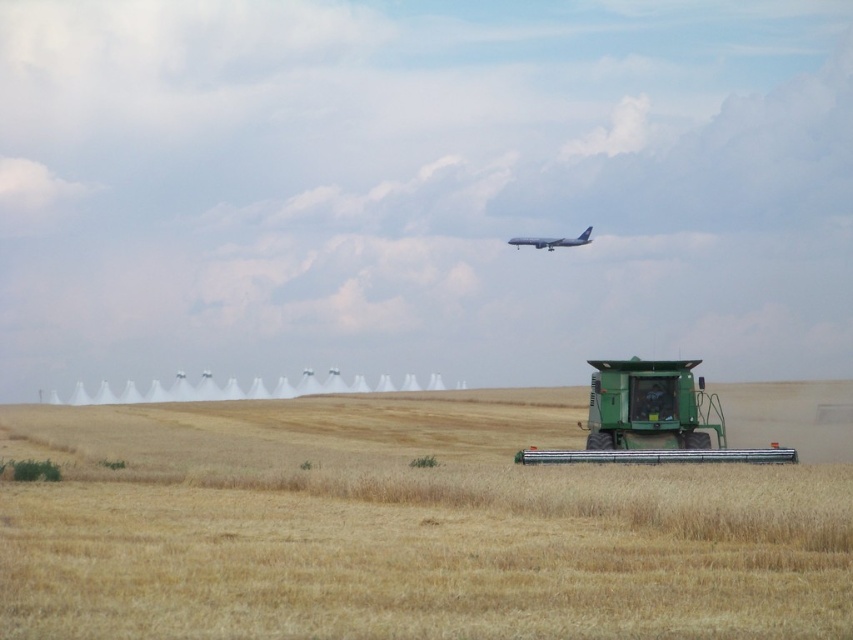
Question: Can you confirm if green matte combine at lower right is bigger than white matte airplane at upper center?

Choices:
 (A) yes
 (B) no

Answer: (B)

Question: Considering the real-world distances, which object is closest to the golden matte wheat field at center?

Choices:
 (A) white matte airplane at upper center
 (B) green matte combine at lower right

Answer: (B)

Question: Which of these objects is positioned farthest from the golden matte wheat field at center?

Choices:
 (A) white matte airplane at upper center
 (B) green matte combine at lower right

Answer: (A)

Question: Among these points, which one is nearest to the camera?

Choices:
 (A) (601, 422)
 (B) (456, 456)

Answer: (A)

Question: Is green matte combine at lower right positioned in front of white matte airplane at upper center?

Choices:
 (A) yes
 (B) no

Answer: (A)

Question: Is green matte combine at lower right closer to the viewer compared to white matte airplane at upper center?

Choices:
 (A) yes
 (B) no

Answer: (A)